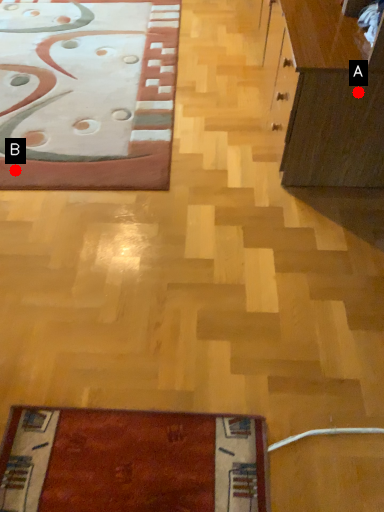
Question: Two points are circled on the image, labeled by A and B beside each circle. Which point is farther to the camera?

Choices:
 (A) A is further
 (B) B is further

Answer: (B)